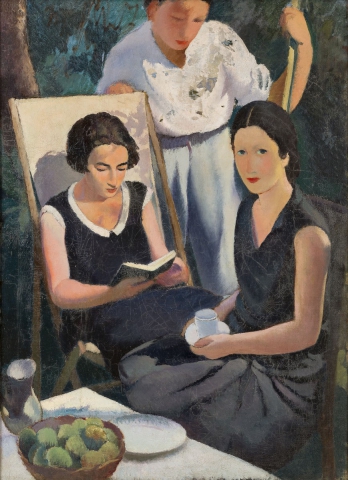
Where is `bowl of fruit`? bowl of fruit is located at coordinates (78, 467).